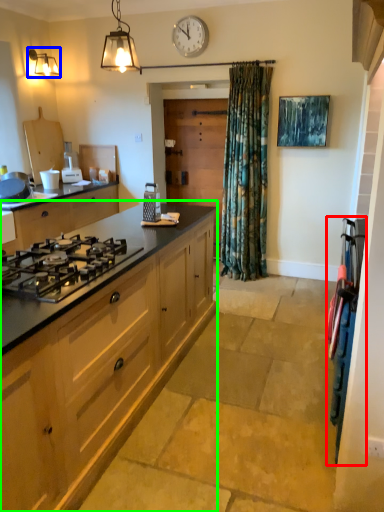
Question: Which object is the closest to the appliance (highlighted by a red box)? Choose among these: lamp (highlighted by a blue box) or cabinetry (highlighted by a green box).

Choices:
 (A) lamp
 (B) cabinetry

Answer: (B)